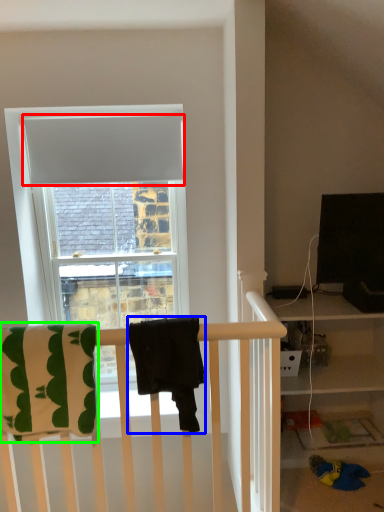
Question: Considering the real-world distances, which object is farthest from curtain (highlighted by a red box)? beach towel (highlighted by a blue box) or beach towel (highlighted by a green box)?

Choices:
 (A) beach towel
 (B) beach towel

Answer: (A)